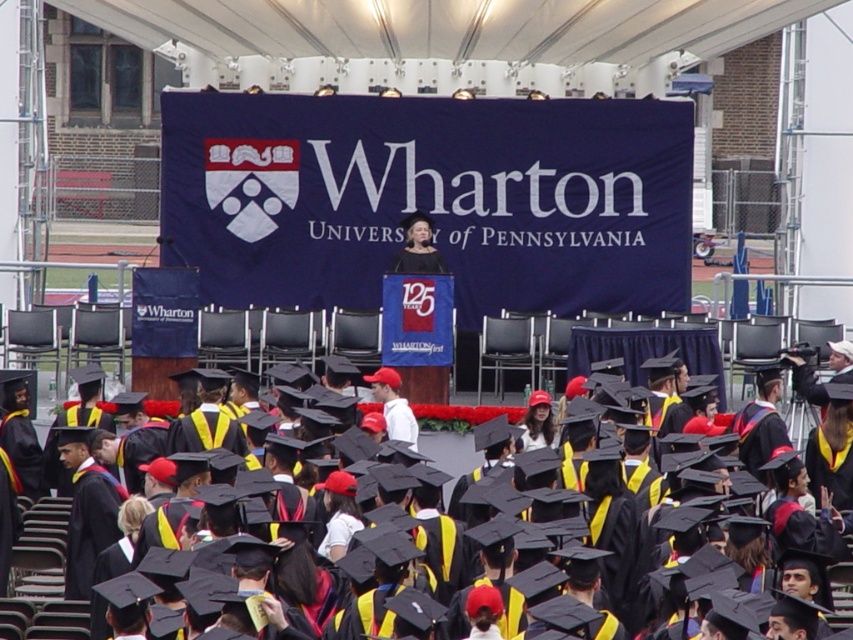
You are a photographer at the Wharton graduation ceremony. You want to take a photo of the black matte graduation cap at center and the matte black dress at center so that both are clearly visible. Based on their positions, which object should be placed closer to the camera to ensure both are in focus?

The black matte graduation cap at center is in front of the matte black dress at center. To ensure both are in focus, the photographer should position the camera closer to the black matte graduation cap at center since it is already closer to the front, allowing the dress behind it to remain in the same focal plane.

Please provide the coordinates of the black matte graduation cap at center in the image. The coordinate system is normalized, with the origin at the bottom left corner of the image. The x and y axes represent the horizontal and vertical directions respectively. The x ranges from 0 to 1 from left to right, and the y ranges from 0 to 1 from bottom to top. Please answer with the coordinates in the format of a tuple with two decimal numbers, rounded to three decimal places. If you cannot find it, please state

The coordinates of the black matte graduation cap at center are at point (840,595).

You are a photographer at the Wharton graduation ceremony. You need to capture a photo of the black matte graduation cap at center and the matte black dress at center. Which object should you zoom in on to ensure both are clearly visible in the frame?

The black matte graduation cap at center is bigger than the matte black dress at center, so you should zoom in on the black matte graduation cap at center to ensure both are clearly visible in the frame.